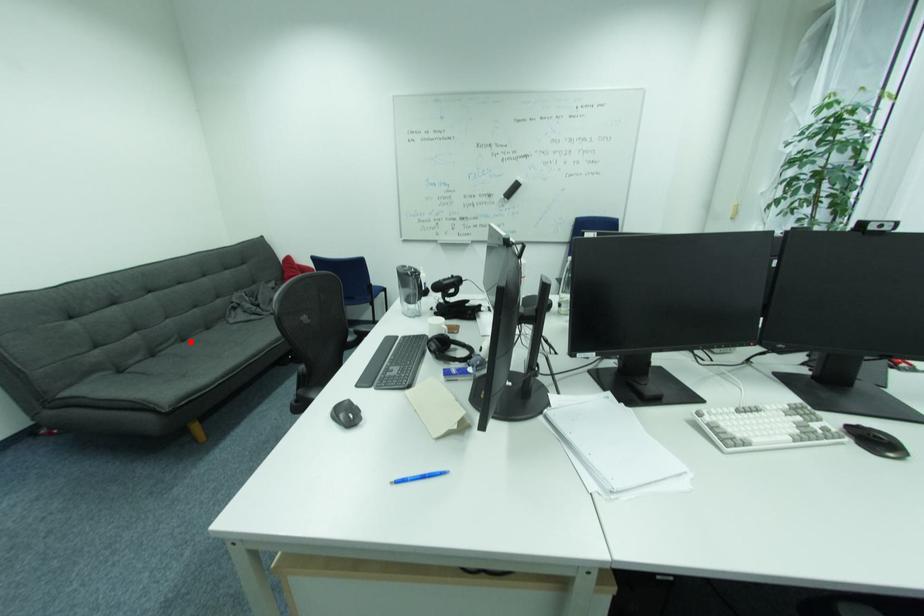
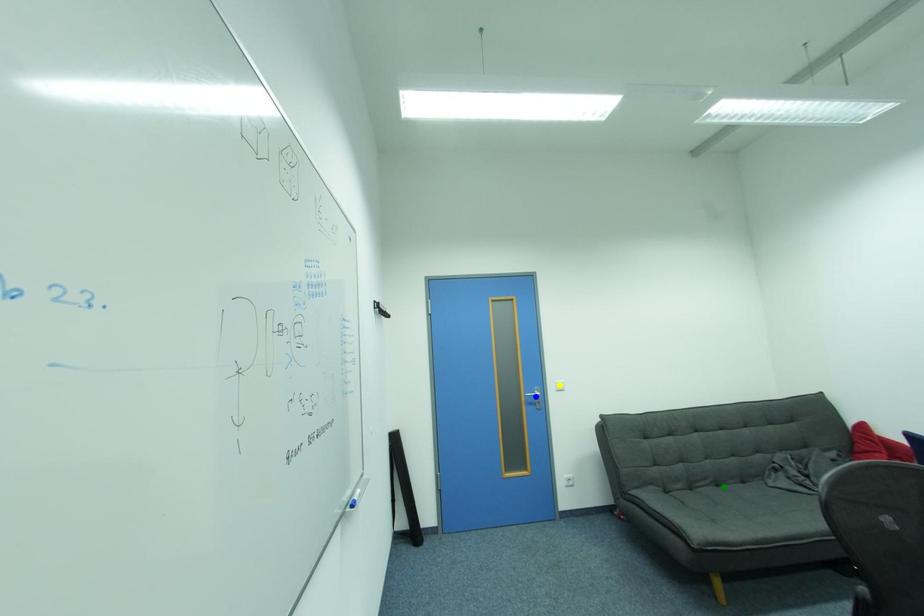
Question: I am providing you with two images of the same scene from different viewpoints. A red point is marked on the first image. You are given multiple points on the second image. In image 2, which mark is for the same physical point as the one in image 1?

Choices:
 (A) green point
 (B) yellow point
 (C) blue point

Answer: (A)